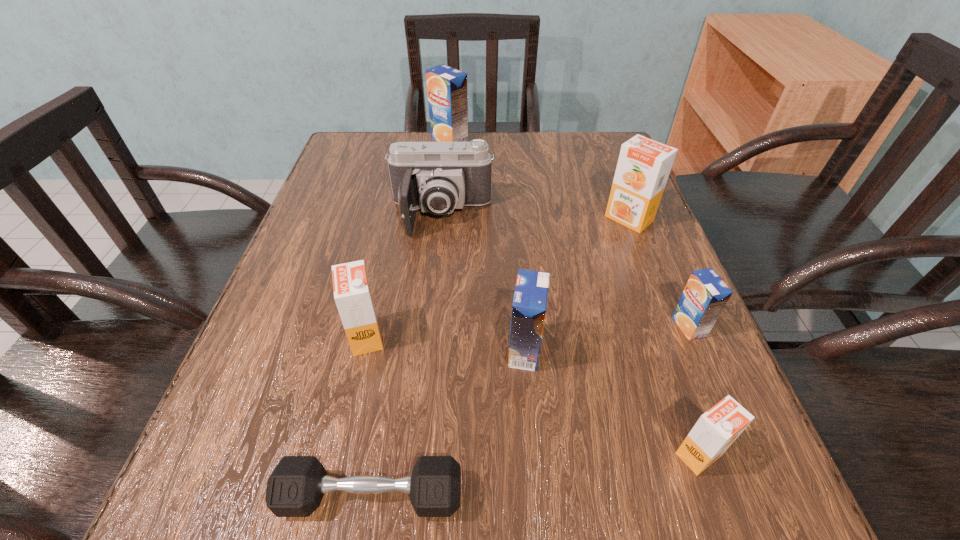
You are a GUI agent. You are given a task and a screenshot of the screen. Output one action in this format:
    pyautogui.click(x=<x>, y=<y>)
    Task: Click on the vacant space at the far left corner of the desktop
    This screenshot has width=960, height=540.
    Given the screenshot: What is the action you would take?
    pyautogui.click(x=360, y=159)

Image resolution: width=960 pixels, height=540 pixels. What are the coordinates of `vacant space at the far right corner of the desktop` in the screenshot? It's located at (575, 169).

The image size is (960, 540). I want to click on vacant area that lies between the fourth object from right to left and the nearest orange orange juice, so click(612, 402).

The image size is (960, 540). I want to click on free spot between the rightmost blue orange_juice and the nearest orange orange juice, so click(x=694, y=390).

The width and height of the screenshot is (960, 540). Find the location of `free space between the smallest blue orange_juice and the third orange_juice from left to right`. free space between the smallest blue orange_juice and the third orange_juice from left to right is located at coordinates (607, 339).

Locate an element on the screen. The height and width of the screenshot is (540, 960). free space between the second blue orange_juice from right to left and the leftmost orange_juice is located at coordinates 445,344.

This screenshot has width=960, height=540. What are the coordinates of `free space between the nearest orange_juice and the farthest blue orange_juice` in the screenshot? It's located at (574, 297).

In order to click on vacant space in between the farthest object and the smallest blue orange_juice in this screenshot , I will do `click(569, 233)`.

The height and width of the screenshot is (540, 960). Find the location of `vacant area that lies between the dumbbell and the nearest orange_juice`. vacant area that lies between the dumbbell and the nearest orange_juice is located at coordinates (535, 475).

Find the location of a particular element. This screenshot has height=540, width=960. vacant region between the nearest orange orange juice and the rightmost blue orange_juice is located at coordinates (694, 390).